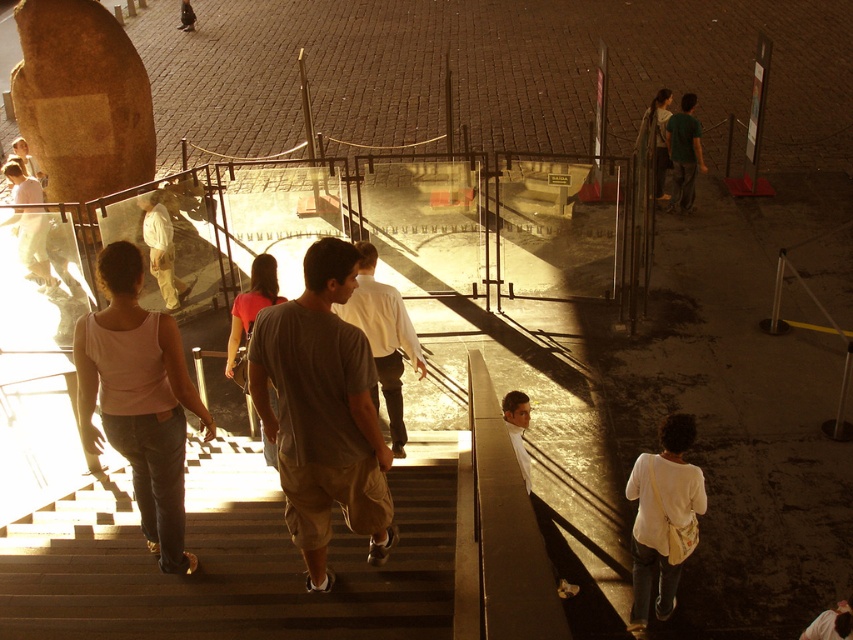
Question: Does dark green shirt at upper right appear on the left side of light brown leather jacket at lower right?

Choices:
 (A) yes
 (B) no

Answer: (B)

Question: Which object is closer to the camera taking this photo?

Choices:
 (A) gray cotton shirt at center
 (B) pink fabric tank top at center
 (C) wooden stairs at center

Answer: (C)

Question: Which object is positioned closest to the light brown cotton t-shirt at center?

Choices:
 (A) pink fabric shirt at center
 (B) dark green shirt at upper right
 (C) white fabric bag at lower right

Answer: (A)

Question: Which object is positioned closest to the dark green shirt at upper right?

Choices:
 (A) gray cotton shirt at center
 (B) wooden stairs at center
 (C) light beige pants at center
 (D) dark brown hair at upper right

Answer: (D)

Question: Is white fabric bag at lower right positioned before dark green shirt at upper right?

Choices:
 (A) yes
 (B) no

Answer: (A)

Question: Is the position of light brown cotton t-shirt at center more distant than that of dark brown hair at upper right?

Choices:
 (A) no
 (B) yes

Answer: (A)